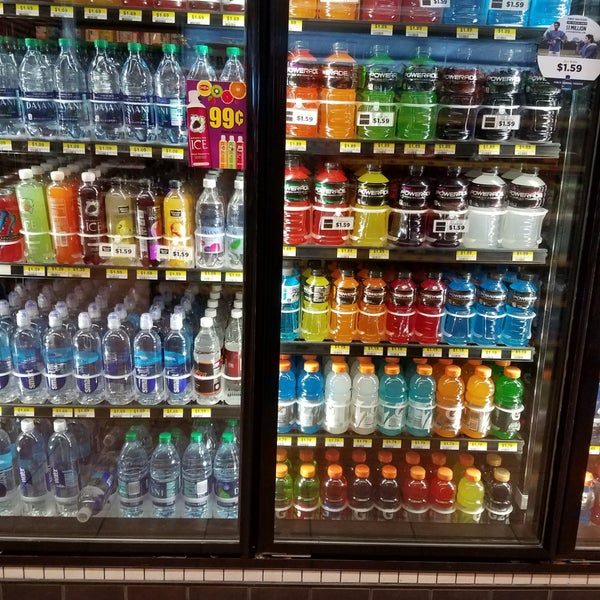
Locate an element on the screen. another refrigerated case is located at coordinates (587, 518).